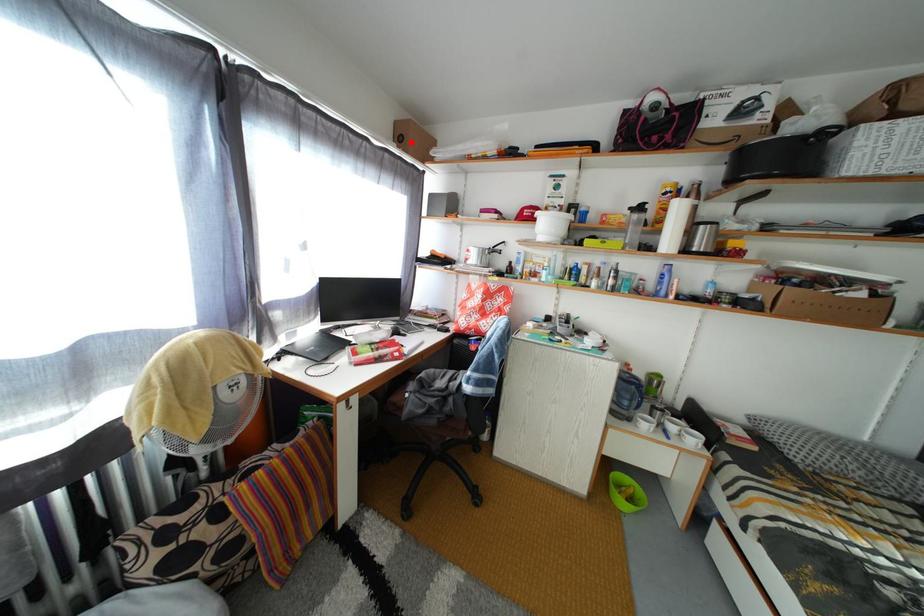
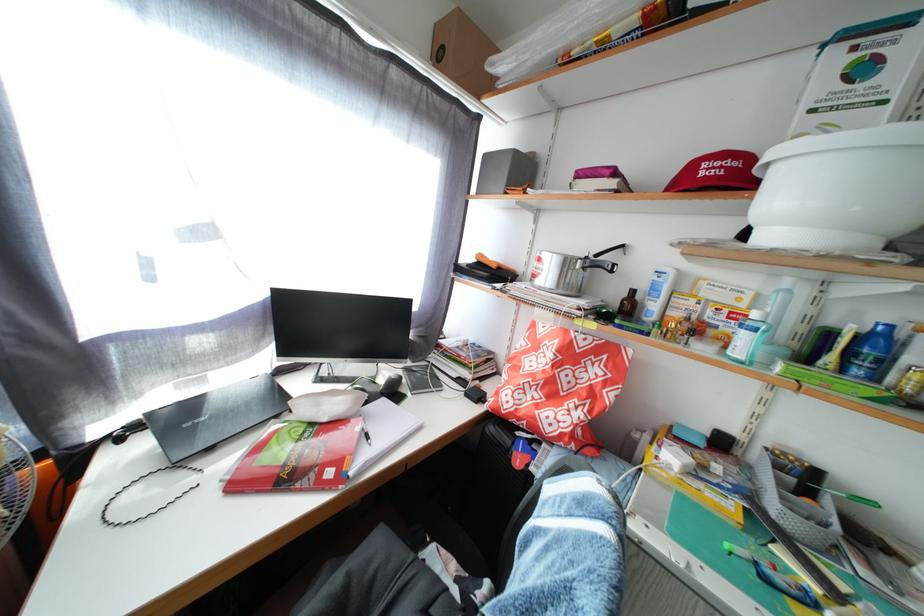
The point at the highlighted location is marked in the first image. Where is the corresponding point in the second image?

(452, 54)